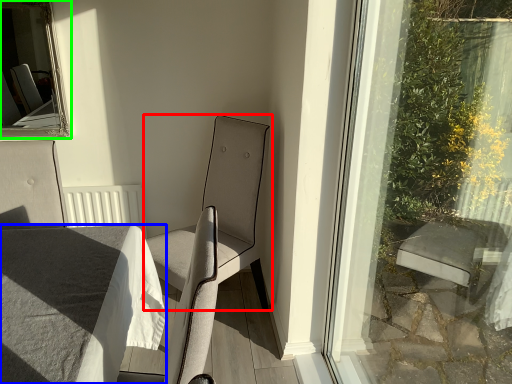
Question: Which object is positioned closest to chair (highlighted by a red box)? Select from table (highlighted by a blue box) and bay window (highlighted by a green box).

Choices:
 (A) table
 (B) bay window

Answer: (A)